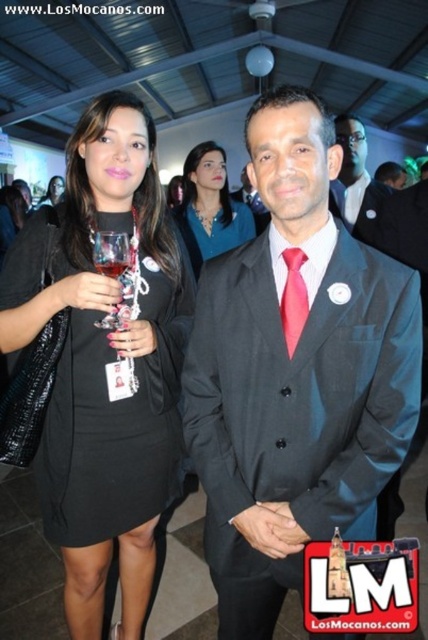
Which is above, matte black suit at center or red satin tie at center?

matte black suit at center

Does matte black suit at center have a smaller size compared to red satin tie at center?

No.

Locate an element on the screen. The image size is (428, 640). matte black suit at center is located at coordinates (356, 179).

Can you confirm if matte black suit at center is positioned above matte black dress at center?

No, matte black suit at center is not above matte black dress at center.

Is point (345, 196) in front of point (59, 198)?

Yes.

Find the location of a particular element. The image size is (428, 640). matte black suit at center is located at coordinates (356, 179).

Who is more distant from viewer, (115, 240) or (44, 196)?

Point (44, 196)

Is transparent glass at center taller than matte black dress at center?

In fact, transparent glass at center may be shorter than matte black dress at center.

Locate an element on the screen. transparent glass at center is located at coordinates (110, 253).